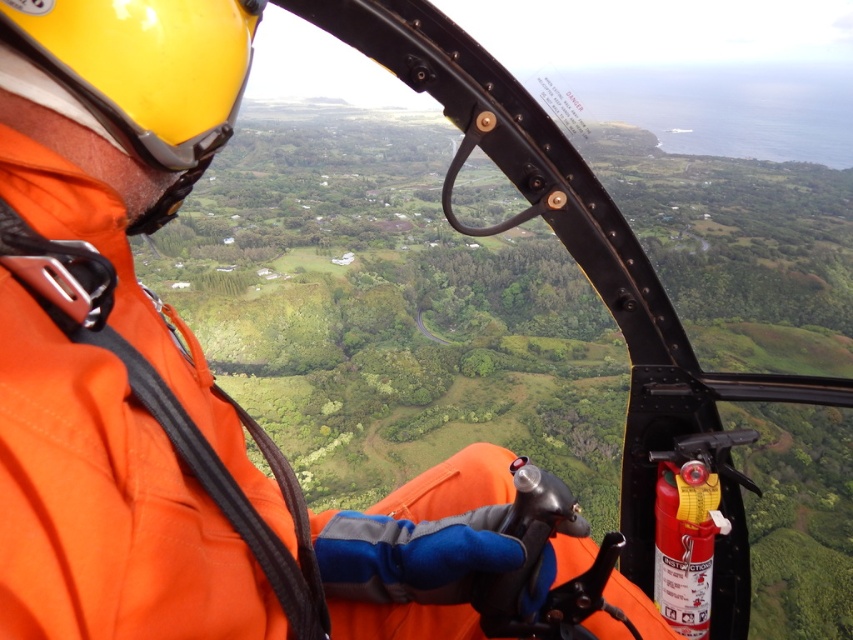
Question: Does orange fabric jacket at center appear over yellow matte helmet at upper left?

Choices:
 (A) yes
 (B) no

Answer: (B)

Question: Which object appears closest to the camera in this image?

Choices:
 (A) yellow matte helmet at upper left
 (B) orange fabric jacket at center

Answer: (B)

Question: Can you confirm if orange fabric jacket at center is thinner than yellow matte helmet at upper left?

Choices:
 (A) no
 (B) yes

Answer: (A)

Question: Which point is farther to the camera?

Choices:
 (A) yellow matte helmet at upper left
 (B) orange fabric jacket at center

Answer: (A)

Question: Does orange fabric jacket at center appear on the left side of yellow matte helmet at upper left?

Choices:
 (A) yes
 (B) no

Answer: (B)